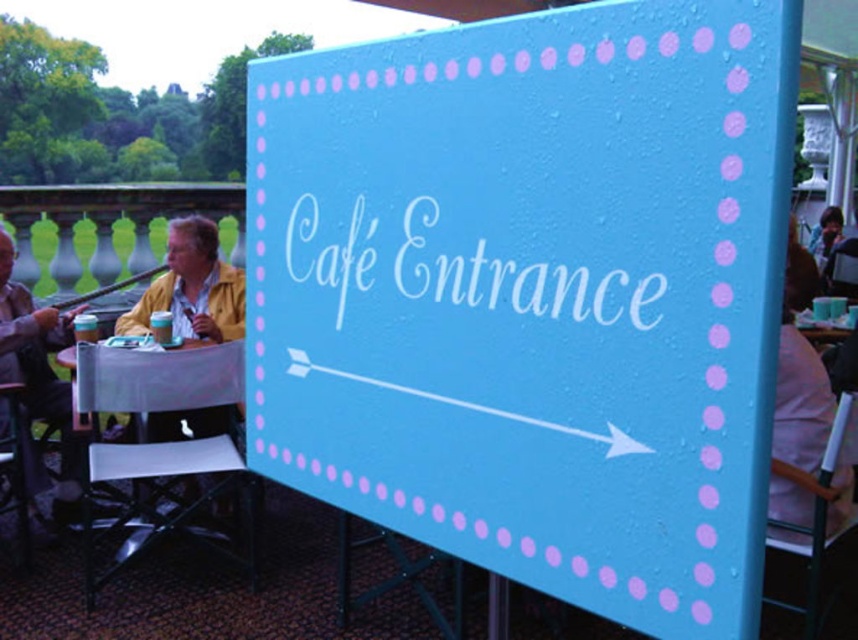
In the scene shown: Is light blue painted board at center taller than matte yellow jacket at left?

No.

Which is more to the right, light blue painted board at center or matte yellow jacket at left?

light blue painted board at center is more to the right.

Which is behind, point (255, 401) or point (76, 449)?

Point (76, 449)

The image size is (858, 640). In order to click on light blue painted board at center in this screenshot , I will do pos(533,294).

Between light blue painted board at center and white plastic table at lower left, which one is positioned higher?

Positioned higher is light blue painted board at center.

Which is more to the left, light blue painted board at center or white plastic table at lower left?

Positioned to the left is white plastic table at lower left.

Identify the location of light blue painted board at center. The width and height of the screenshot is (858, 640). (533, 294).

The height and width of the screenshot is (640, 858). Identify the location of light blue painted board at center. (533, 294).

Can you confirm if light blue painted board at center is positioned above yellow matte jacket at left?

No.

Between light blue painted board at center and yellow matte jacket at left, which one has less height?

yellow matte jacket at left is shorter.

Between point (565, 264) and point (224, 305), which one is positioned behind?

Point (224, 305)

Where is `light blue painted board at center`? This screenshot has width=858, height=640. light blue painted board at center is located at coordinates (533, 294).